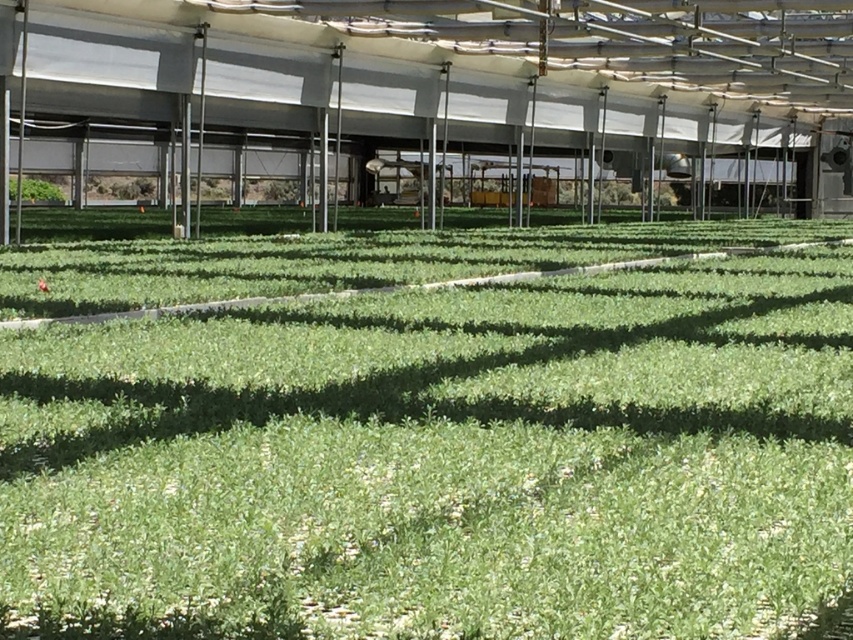
You are a gardener who wants to water the plants in the greenhouse. You see the green leafy grass at center and the green leafy plant at left. Which one is closer to the left side of the greenhouse?

The green leafy plant at left is closer to the left side of the greenhouse because it is positioned on the left side of the green leafy grass at center.

You are a gardener who wants to water the green leafy grass at center and the green leafy plant at left. Which one should you water first if you want to avoid the shadow of the metal poles and beams from blocking the sunlight?

The green leafy grass at center should be watered first because it is positioned under the green leafy plant at left, meaning it receives less sunlight due to the shadow cast by the plant. Watering it first ensures it gets adequate sunlight before the shadow moves.

You are standing inside the greenhouse and want to reach the exit located outside the greenhouse. You see the green leafy grass at center and the green leafy plant at left. Which object is closer to you as you move towards the exit?

The green leafy grass at center is closer to you than the green leafy plant at left, so the green leafy grass at center would be nearer as you move towards the exit.